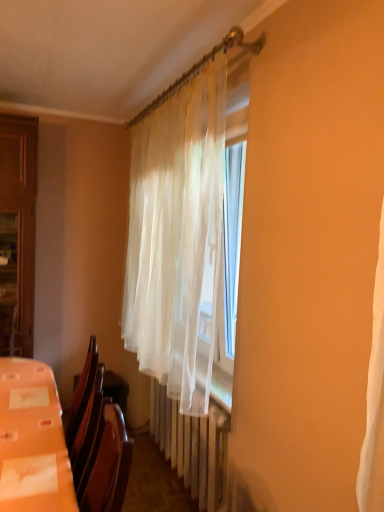
Question: Would you consider white plastic radiator at center to be distant from orange plastic table at lower left?

Choices:
 (A) no
 (B) yes

Answer: (A)

Question: Is orange plastic table at lower left a part of white plastic radiator at center?

Choices:
 (A) yes
 (B) no

Answer: (B)

Question: Considering the relative sizes of white plastic radiator at center and orange plastic table at lower left in the image provided, is white plastic radiator at center smaller than orange plastic table at lower left?

Choices:
 (A) yes
 (B) no

Answer: (B)

Question: Does white plastic radiator at center appear on the left side of orange plastic table at lower left?

Choices:
 (A) yes
 (B) no

Answer: (B)

Question: Considering the relative positions of white plastic radiator at center and orange plastic table at lower left in the image provided, is white plastic radiator at center in front of orange plastic table at lower left?

Choices:
 (A) yes
 (B) no

Answer: (B)

Question: Considering the positions of white plastic radiator at center and orange plastic table at lower left in the image, is white plastic radiator at center taller or shorter than orange plastic table at lower left?

Choices:
 (A) short
 (B) tall

Answer: (B)

Question: In terms of width, does white plastic radiator at center look wider or thinner when compared to orange plastic table at lower left?

Choices:
 (A) thin
 (B) wide

Answer: (A)

Question: From the image's perspective, is white plastic radiator at center located above or below orange plastic table at lower left?

Choices:
 (A) above
 (B) below

Answer: (B)

Question: From a real-world perspective, is white plastic radiator at center physically located above or below orange plastic table at lower left?

Choices:
 (A) above
 (B) below

Answer: (B)

Question: Choose the correct answer: Is white plastic radiator at center inside translucent white curtain at center or outside it?

Choices:
 (A) inside
 (B) outside

Answer: (B)

Question: From the image's perspective, is white plastic radiator at center positioned above or below translucent white curtain at center?

Choices:
 (A) above
 (B) below

Answer: (B)

Question: Looking at their shapes, would you say white plastic radiator at center is wider or thinner than translucent white curtain at center?

Choices:
 (A) thin
 (B) wide

Answer: (A)

Question: Is white plastic radiator at center bigger or smaller than translucent white curtain at center?

Choices:
 (A) small
 (B) big

Answer: (A)

Question: From a real-world perspective, is translucent white curtain at center physically located above or below orange plastic table at lower left?

Choices:
 (A) above
 (B) below

Answer: (A)

Question: Does point (127, 239) appear closer or farther from the camera than point (13, 373)?

Choices:
 (A) closer
 (B) farther

Answer: (B)